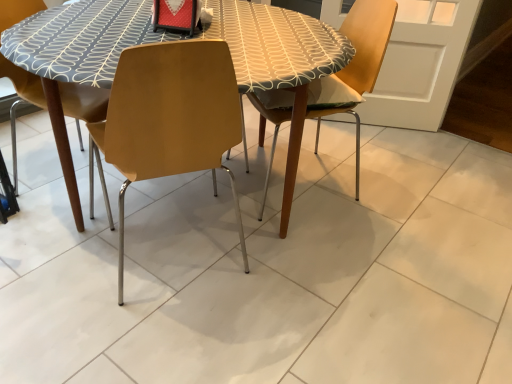
Question: Can you confirm if wooden chair at center, placed as the 1th chair when sorted from right to left, is thinner than matte wood chair at center, acting as the 1th chair starting from the left?

Choices:
 (A) yes
 (B) no

Answer: (B)

Question: Could you tell me if wooden chair at center, placed as the 1th chair when sorted from right to left, is facing matte wood chair at center, the 2th chair from the right?

Choices:
 (A) no
 (B) yes

Answer: (B)

Question: Considering the relative sizes of wooden chair at center, the second chair in the left-to-right sequence, and matte wood chair at center, acting as the 1th chair starting from the left, in the image provided, is wooden chair at center, the second chair in the left-to-right sequence, wider than matte wood chair at center, acting as the 1th chair starting from the left,?

Choices:
 (A) no
 (B) yes

Answer: (B)

Question: Are wooden chair at center, the second chair in the left-to-right sequence, and matte wood chair at center, the 2th chair from the right, far apart?

Choices:
 (A) yes
 (B) no

Answer: (B)

Question: Can you confirm if wooden chair at center, placed as the 1th chair when sorted from right to left, is shorter than matte wood chair at center, acting as the 1th chair starting from the left?

Choices:
 (A) yes
 (B) no

Answer: (A)

Question: Is wooden chair at center, placed as the 1th chair when sorted from right to left, positioned in front of matte wood chair at center, the 2th chair from the right?

Choices:
 (A) yes
 (B) no

Answer: (B)

Question: Is matte wood chair at center, the 2th chair from the right, facing towards wooden chair at center, the second chair in the left-to-right sequence?

Choices:
 (A) yes
 (B) no

Answer: (B)

Question: Considering the relative positions of matte wood chair at center, acting as the 1th chair starting from the left, and wooden chair at center, the second chair in the left-to-right sequence, in the image provided, is matte wood chair at center, acting as the 1th chair starting from the left, in front of wooden chair at center, the second chair in the left-to-right sequence,?

Choices:
 (A) yes
 (B) no

Answer: (A)

Question: From the image's perspective, does matte wood chair at center, acting as the 1th chair starting from the left, appear higher than wooden chair at center, the second chair in the left-to-right sequence?

Choices:
 (A) no
 (B) yes

Answer: (A)

Question: From a real-world perspective, does matte wood chair at center, acting as the 1th chair starting from the left, stand above wooden chair at center, placed as the 1th chair when sorted from right to left?

Choices:
 (A) yes
 (B) no

Answer: (A)

Question: Is matte wood chair at center, the 2th chair from the right, not near wooden chair at center, the second chair in the left-to-right sequence?

Choices:
 (A) no
 (B) yes

Answer: (A)

Question: Is matte wood chair at center, the 2th chair from the right, at the left side of wooden chair at center, the second chair in the left-to-right sequence?

Choices:
 (A) yes
 (B) no

Answer: (A)

Question: Considering their positions, is matte wood chair at center, acting as the 1th chair starting from the left, located in front of or behind wooden chair at center, the second chair in the left-to-right sequence?

Choices:
 (A) behind
 (B) front

Answer: (B)